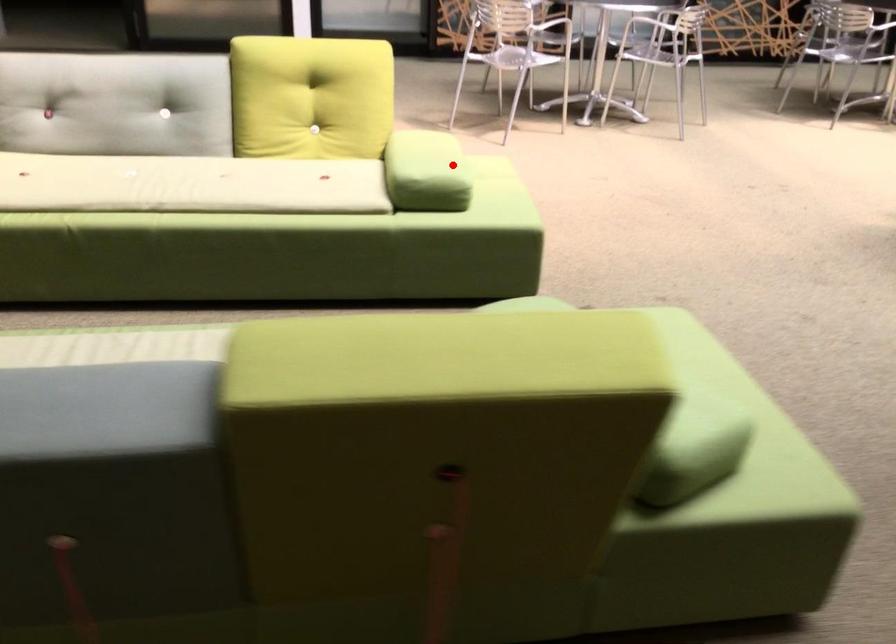
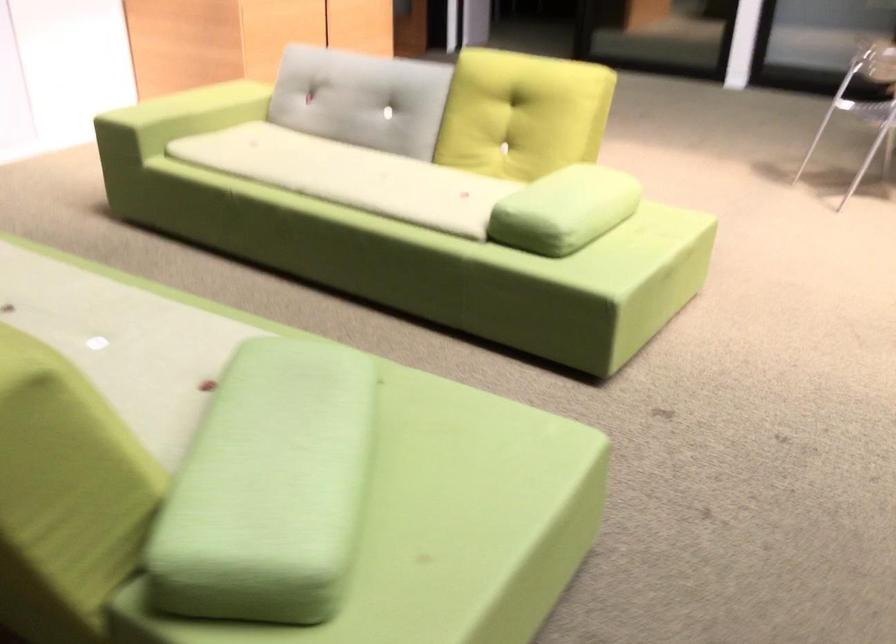
Question: A red point is marked in image1. In image2, is the corresponding 3D point closer to the camera or farther? Reply with the corresponding letter.

Choices:
 (A) The corresponding 3D point is closer.
 (B) The corresponding 3D point is farther.

Answer: (A)